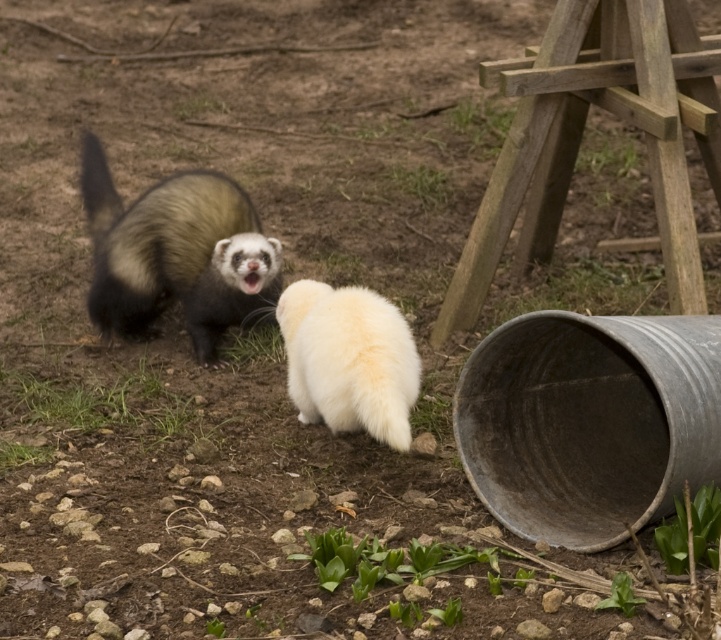
Question: Which of the following is the closest to the observer?

Choices:
 (A) wooden at right
 (B) fuzzy black and white ferret at upper left

Answer: (A)

Question: Which of the following is the farthest from the observer?

Choices:
 (A) (490, 221)
 (B) (156, 253)

Answer: (B)

Question: Does wooden at right appear over fuzzy black and white ferret at upper left?

Choices:
 (A) no
 (B) yes

Answer: (B)

Question: Can you confirm if wooden at right is wider than fuzzy black and white ferret at upper left?

Choices:
 (A) yes
 (B) no

Answer: (A)

Question: Is wooden at right below fuzzy black and white ferret at upper left?

Choices:
 (A) yes
 (B) no

Answer: (B)